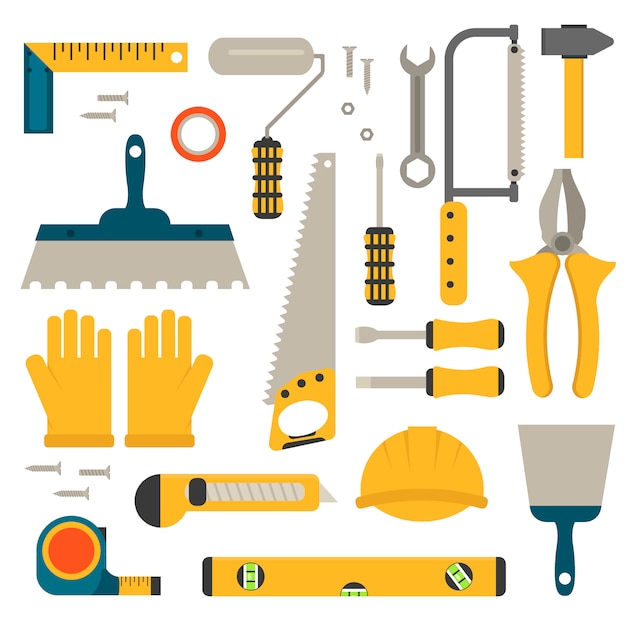
Image resolution: width=626 pixels, height=626 pixels. I want to click on screws, so click(x=49, y=475), click(x=77, y=496), click(x=94, y=471), click(x=103, y=116), click(x=113, y=98), click(x=351, y=64), click(x=362, y=66).